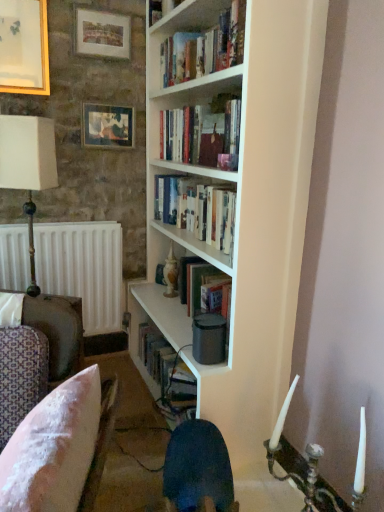
Question: Is white fabric-covered lampshade at left next to white matte bookcase at center?

Choices:
 (A) yes
 (B) no

Answer: (B)

Question: From a real-world perspective, is white fabric-covered lampshade at left physically above white matte bookcase at center?

Choices:
 (A) yes
 (B) no

Answer: (A)

Question: Can you confirm if white fabric-covered lampshade at left is thinner than white matte bookcase at center?

Choices:
 (A) no
 (B) yes

Answer: (B)

Question: From a real-world perspective, is white fabric-covered lampshade at left located beneath white matte bookcase at center?

Choices:
 (A) no
 (B) yes

Answer: (A)

Question: Could you tell me if white fabric-covered lampshade at left is facing white matte bookcase at center?

Choices:
 (A) no
 (B) yes

Answer: (A)

Question: Visually, is matte wooden picture frame at upper center, which ranks as the second picture frame in left-to-right order, positioned to the left or to the right of matte wooden picture frame at upper left, placed as the 1th picture frame when sorted from right to left?

Choices:
 (A) left
 (B) right

Answer: (A)

Question: Choose the correct answer: Is matte wooden picture frame at upper center, the 2th picture frame viewed from the right, inside matte wooden picture frame at upper left, placed as the 1th picture frame when sorted from right to left, or outside it?

Choices:
 (A) outside
 (B) inside

Answer: (A)

Question: Looking at their shapes, would you say matte wooden picture frame at upper center, which ranks as the second picture frame in left-to-right order, is wider or thinner than matte wooden picture frame at upper left, arranged as the third picture frame when viewed from the left?

Choices:
 (A) thin
 (B) wide

Answer: (A)

Question: From the image's perspective, is matte wooden picture frame at upper center, which ranks as the second picture frame in left-to-right order, located above or below matte wooden picture frame at upper left, arranged as the third picture frame when viewed from the left?

Choices:
 (A) above
 (B) below

Answer: (A)

Question: Is hardcover books at center, the second book viewed from the top, taller or shorter than wooden picture frame at upper left, the 1th picture frame viewed from the left?

Choices:
 (A) tall
 (B) short

Answer: (B)

Question: Is hardcover books at center, arranged as the 1th book when ordered from the bottom, situated inside wooden picture frame at upper left, the 1th picture frame viewed from the left, or outside?

Choices:
 (A) inside
 (B) outside

Answer: (B)

Question: Is point (170, 112) positioned closer to the camera than point (3, 16)?

Choices:
 (A) farther
 (B) closer

Answer: (A)

Question: In terms of size, does hardcover books at center, the second book viewed from the top, appear bigger or smaller than wooden picture frame at upper left, the 1th picture frame viewed from the left?

Choices:
 (A) big
 (B) small

Answer: (A)

Question: Is pink fabric cushion at lower left to the left or to the right of matte wooden picture frame at upper left, arranged as the third picture frame when viewed from the left, in the image?

Choices:
 (A) left
 (B) right

Answer: (B)

Question: From the image's perspective, is pink fabric cushion at lower left above or below matte wooden picture frame at upper left, placed as the 1th picture frame when sorted from right to left?

Choices:
 (A) above
 (B) below

Answer: (B)